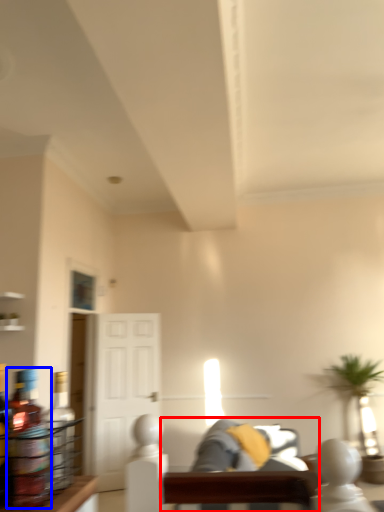
Question: Which object appears farthest to the camera in this image, couch (highlighted by a red box) or bottle (highlighted by a blue box)?

Choices:
 (A) couch
 (B) bottle

Answer: (A)